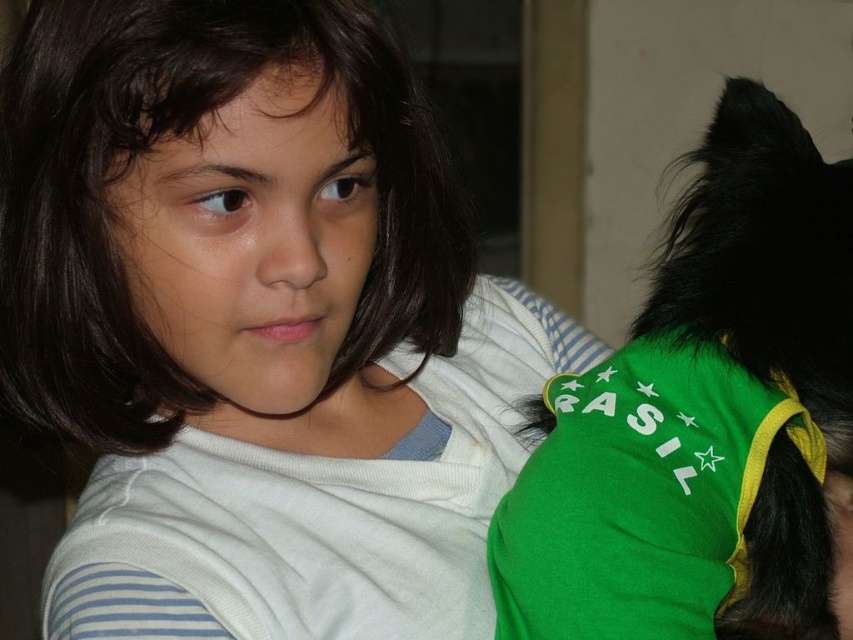
Question: Is green fabric dog at right bigger than dark brown hair at center?

Choices:
 (A) no
 (B) yes

Answer: (B)

Question: Which point is closer to the camera?

Choices:
 (A) (369, 131)
 (B) (791, 378)

Answer: (A)

Question: Does green fabric dog at right appear over dark brown hair at center?

Choices:
 (A) yes
 (B) no

Answer: (B)

Question: Is green fabric dog at right wider than dark brown hair at center?

Choices:
 (A) yes
 (B) no

Answer: (B)